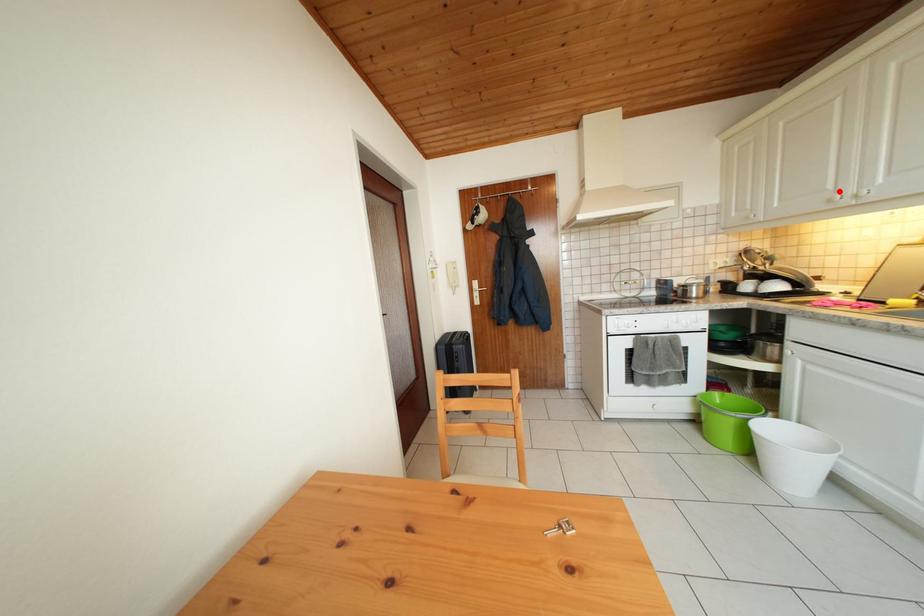
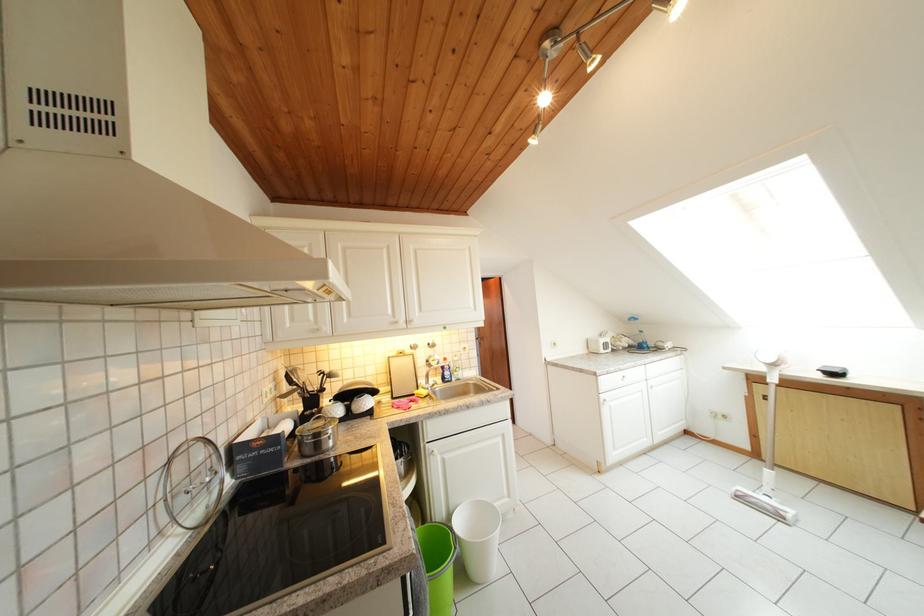
Locate, in the second image, the point that corresponds to the highlighted location in the first image.

(398, 317)